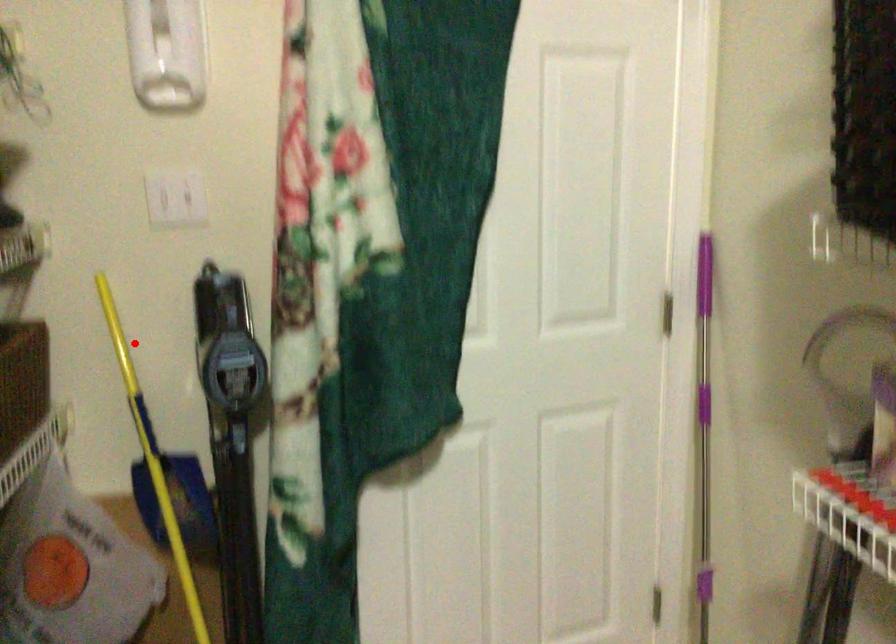
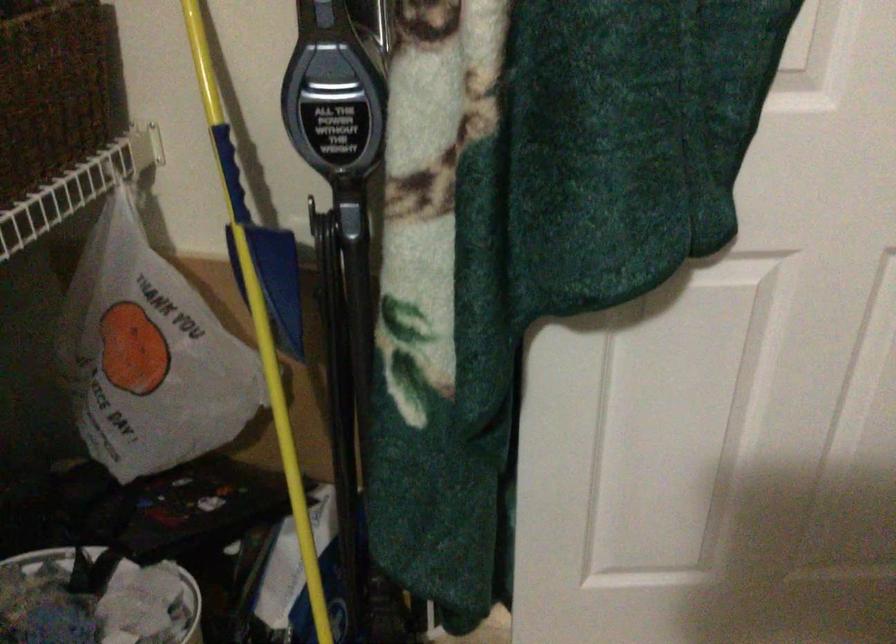
Question: I am providing you with two images of the same scene from different viewpoints. Image1 has a red point marked. In image2, the corresponding 3D location appears at what relative position? Reply with the corresponding letter.

Choices:
 (A) Closer
 (B) Farther

Answer: (A)